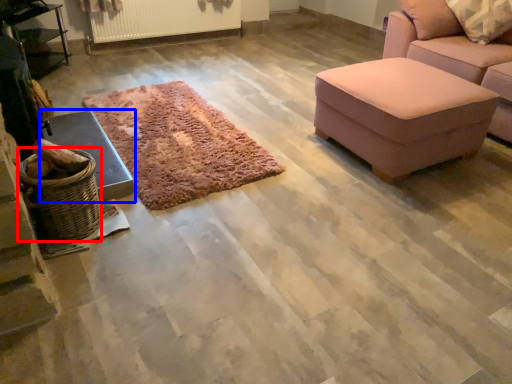
Question: Which of the following is the farthest to the observer, basket (highlighted by a red box) or furniture (highlighted by a blue box)?

Choices:
 (A) basket
 (B) furniture

Answer: (B)